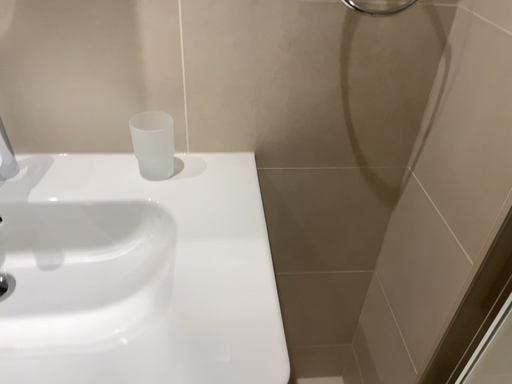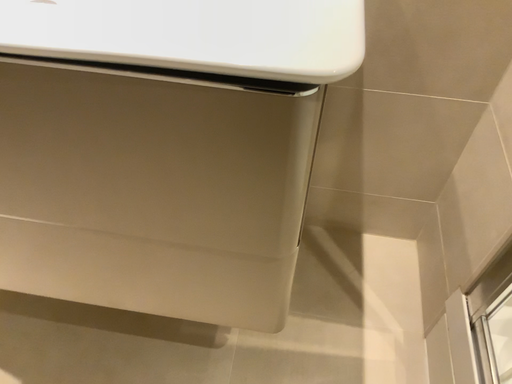
Question: How did the camera likely rotate when shooting the video?

Choices:
 (A) rotated upward
 (B) rotated downward

Answer: (B)